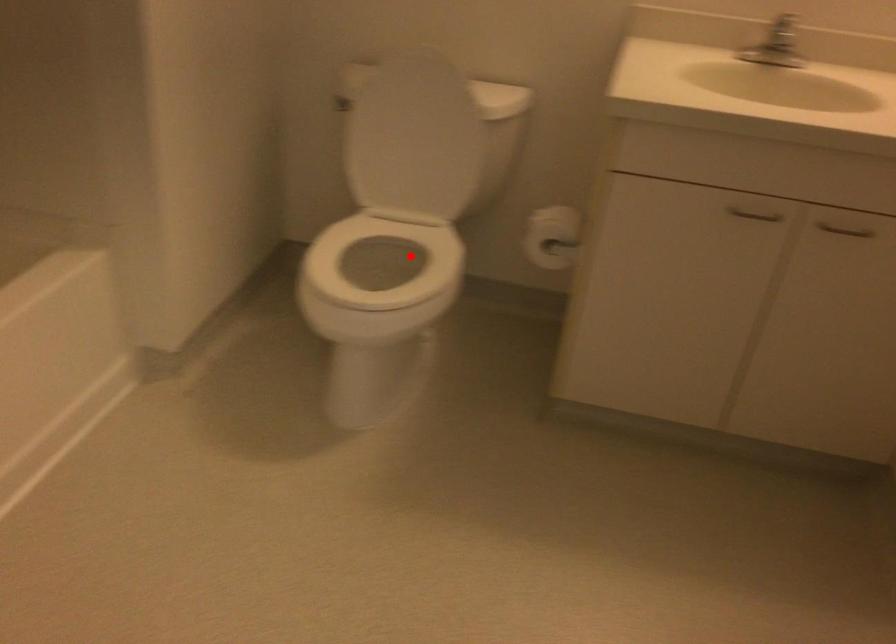
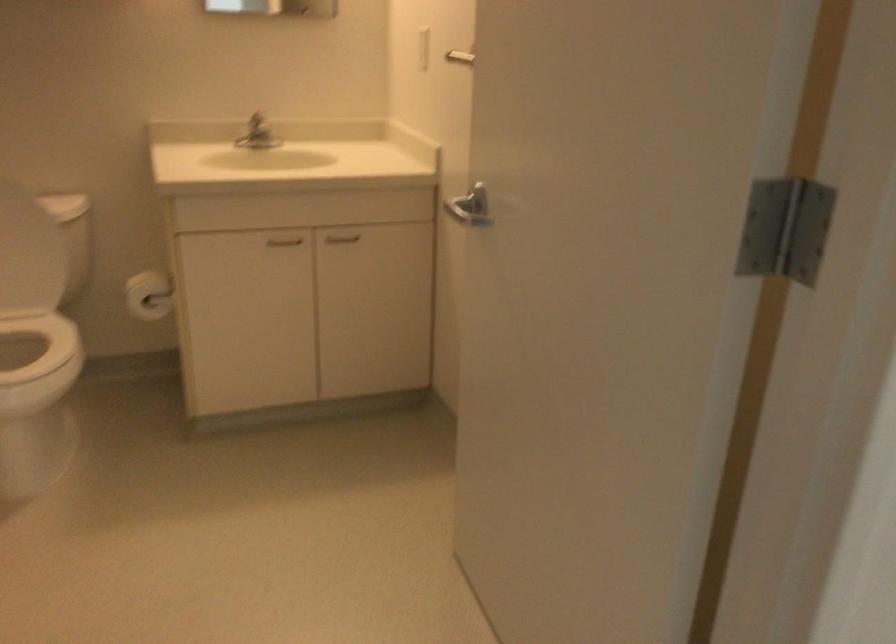
Find the pixel in the second image that matches the highlighted location in the first image.

(22, 341)